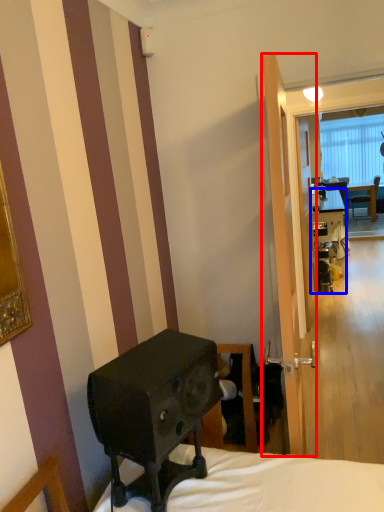
Question: Among these objects, which one is farthest to the camera, screen door (highlighted by a red box) or desk (highlighted by a blue box)?

Choices:
 (A) screen door
 (B) desk

Answer: (B)